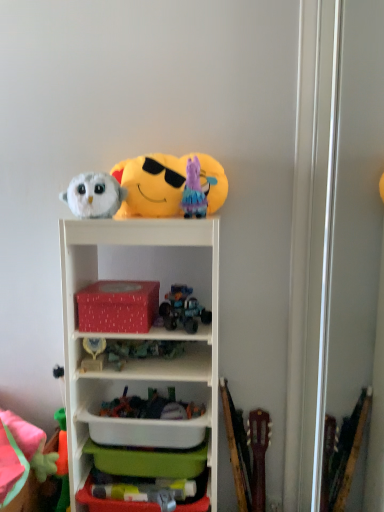
Locate an element on the screen. This screenshot has width=384, height=512. translucent plastic toy at center, positioned as the sixth toy in top-to-bottom order is located at coordinates (141, 350).

I want to click on red matte tissue box at center, the 1th storage box positioned from the top, so click(118, 306).

How much space does green plastic storage box at lower center, the first storage box ordered from the bottom, occupy horizontally?

5.91 inches.

What do you see at coordinates (183, 309) in the screenshot? I see `shiny metallic truck at center, which ranks as the fourth toy in top-to-bottom order` at bounding box center [183, 309].

What is the approximate width of gold metallic trophy at center, acting as the third toy starting from the bottom?

gold metallic trophy at center, acting as the third toy starting from the bottom, is 6.25 centimeters wide.

Locate an element on the screen. Image resolution: width=384 pixels, height=512 pixels. white plastic shelf at center is located at coordinates coord(140,334).

Is red matte tissue box at center, acting as the 2th storage box starting from the bottom, oriented away from shiny metallic truck at center, marked as the 4th toy in a bottom-to-top arrangement?

No, red matte tissue box at center, acting as the 2th storage box starting from the bottom,'s orientation is not away from shiny metallic truck at center, marked as the 4th toy in a bottom-to-top arrangement.

Which point is more forward, (79,311) or (184,321)?

The point (79,311) is more forward.

In order to click on storage box located above the shiny metallic truck at center, marked as the 4th toy in a bottom-to-top arrangement (from a real-world perspective) in this screenshot , I will do `click(118, 306)`.

Considering the sizes of objects red matte tissue box at center, acting as the 2th storage box starting from the bottom, and shiny metallic truck at center, which ranks as the fourth toy in top-to-bottom order, in the image provided, who is shorter, red matte tissue box at center, acting as the 2th storage box starting from the bottom, or shiny metallic truck at center, which ranks as the fourth toy in top-to-bottom order,?

shiny metallic truck at center, which ranks as the fourth toy in top-to-bottom order.

Measure the distance between fluffy white owl at upper left, which is counted as the third toy, starting from the top, and shiny metallic truck at center, which ranks as the fourth toy in top-to-bottom order.

The distance of fluffy white owl at upper left, which is counted as the third toy, starting from the top, from shiny metallic truck at center, which ranks as the fourth toy in top-to-bottom order, is 16.00 inches.

Which is behind, point (62, 196) or point (183, 288)?

Positioned behind is point (183, 288).

Is fluffy white owl at upper left, which is counted as the third toy, starting from the top, next to shiny metallic truck at center, which ranks as the fourth toy in top-to-bottom order?

No, fluffy white owl at upper left, which is counted as the third toy, starting from the top, is not with shiny metallic truck at center, which ranks as the fourth toy in top-to-bottom order.

Is fluffy white owl at upper left, acting as the fifth toy starting from the bottom, thinner than shiny metallic truck at center, marked as the 4th toy in a bottom-to-top arrangement?

No, fluffy white owl at upper left, acting as the fifth toy starting from the bottom, is not thinner than shiny metallic truck at center, marked as the 4th toy in a bottom-to-top arrangement.

Between point (96, 286) and point (86, 490), which one is positioned in front?

The point (86, 490) is closer to the camera.

Which is more to the left, red matte tissue box at center, acting as the 2th storage box starting from the bottom, or green plastic storage box at lower center, the first storage box ordered from the bottom?

red matte tissue box at center, acting as the 2th storage box starting from the bottom, is more to the left.

At what (x,y) coordinates should I click in order to perform the action: click on storage box below the red matte tissue box at center, acting as the 2th storage box starting from the bottom (from the image's perspective). Please return your answer as a coordinate pair (x, y). The image size is (384, 512). Looking at the image, I should click on (110, 502).

Which object is thinner, red matte tissue box at center, acting as the 2th storage box starting from the bottom, or green plastic storage box at lower center, the first storage box ordered from the bottom?

With smaller width is green plastic storage box at lower center, the first storage box ordered from the bottom.

Considering the relative sizes of gold metallic trophy at center, which ranks as the 5th toy in top-to-bottom order, and fluffy pink plush at lower left, marked as the seventh toy in a top-to-bottom arrangement, in the image provided, is gold metallic trophy at center, which ranks as the 5th toy in top-to-bottom order, thinner than fluffy pink plush at lower left, marked as the seventh toy in a top-to-bottom arrangement,?

Indeed, gold metallic trophy at center, which ranks as the 5th toy in top-to-bottom order, has a lesser width compared to fluffy pink plush at lower left, marked as the seventh toy in a top-to-bottom arrangement.

Which point is more forward, (x=101, y=338) or (x=7, y=442)?

The point (x=101, y=338) is closer to the camera.

This screenshot has width=384, height=512. In order to click on the 2nd toy below when counting from the gold metallic trophy at center, acting as the third toy starting from the bottom (from the image's perspective) in this screenshot , I will do `click(21, 456)`.

Is fluffy pink plush at lower left, marked as the seventh toy in a top-to-bottom arrangement, looking in the opposite direction of red matte tissue box at center, the 1th storage box positioned from the top?

fluffy pink plush at lower left, marked as the seventh toy in a top-to-bottom arrangement, does not have its back to red matte tissue box at center, the 1th storage box positioned from the top.

From a real-world perspective, is fluffy pink plush at lower left, marked as the seventh toy in a top-to-bottom arrangement, on red matte tissue box at center, acting as the 2th storage box starting from the bottom?

No, from a real-world perspective, fluffy pink plush at lower left, marked as the seventh toy in a top-to-bottom arrangement, is not above red matte tissue box at center, acting as the 2th storage box starting from the bottom.

Is fluffy pink plush at lower left, marked as the seventh toy in a top-to-bottom arrangement, spatially inside red matte tissue box at center, the 1th storage box positioned from the top, or outside of it?

fluffy pink plush at lower left, marked as the seventh toy in a top-to-bottom arrangement, is not inside red matte tissue box at center, the 1th storage box positioned from the top, it's outside.

Is fluffy pink plush at lower left, marked as the seventh toy in a top-to-bottom arrangement, shorter than red matte tissue box at center, the 1th storage box positioned from the top?

No, fluffy pink plush at lower left, marked as the seventh toy in a top-to-bottom arrangement, is not shorter than red matte tissue box at center, the 1th storage box positioned from the top.

Which object is positioned more to the left, fluffy white owl at upper left, which is counted as the third toy, starting from the top, or white plastic container at center?

fluffy white owl at upper left, which is counted as the third toy, starting from the top, is more to the left.

From the image's perspective, between fluffy white owl at upper left, which is counted as the third toy, starting from the top, and white plastic container at center, which one is located above?

From the image's view, fluffy white owl at upper left, which is counted as the third toy, starting from the top, is above.

Who is taller, fluffy white owl at upper left, acting as the fifth toy starting from the bottom, or white plastic container at center?

Standing taller between the two is fluffy white owl at upper left, acting as the fifth toy starting from the bottom.

Does point (66, 201) appear closer or farther from the camera than point (106, 432)?

Point (66, 201) is positioned closer to the camera compared to point (106, 432).

Is point (85, 411) farther from camera compared to point (38, 466)?

Yes, point (85, 411) is behind point (38, 466).

From the image's perspective, is white plastic shelf at center located above fluffy pink plush at lower left, marked as the seventh toy in a top-to-bottom arrangement?

Yes, from the image's perspective, white plastic shelf at center is over fluffy pink plush at lower left, marked as the seventh toy in a top-to-bottom arrangement.

Are white plastic shelf at center and fluffy pink plush at lower left, marked as the seventh toy in a top-to-bottom arrangement, making contact?

white plastic shelf at center and fluffy pink plush at lower left, marked as the seventh toy in a top-to-bottom arrangement, are not in contact.

Based on their positions, is white plastic shelf at center located to the left or right of fluffy pink plush at lower left, positioned as the first toy in bottom-to-top order?

From the image, it's evident that white plastic shelf at center is to the right of fluffy pink plush at lower left, positioned as the first toy in bottom-to-top order.

Locate an element on the screen. Image resolution: width=384 pixels, height=512 pixels. storage box that is behind the shiny metallic truck at center, marked as the 4th toy in a bottom-to-top arrangement is located at coordinates (118, 306).

Where is `the 1st toy positioned above the shiny metallic truck at center, marked as the 4th toy in a bottom-to-top arrangement (from the image's perspective)`? the 1st toy positioned above the shiny metallic truck at center, marked as the 4th toy in a bottom-to-top arrangement (from the image's perspective) is located at coordinates (94, 195).

From the picture: Estimate the real-world distances between objects in this image. Which object is further from red matte tissue box at center, acting as the 2th storage box starting from the bottom, soft plush emoji at upper center, which appears as the 1th toy when viewed from the top, or fluffy pink plush at lower left, positioned as the first toy in bottom-to-top order?

fluffy pink plush at lower left, positioned as the first toy in bottom-to-top order.

Which object lies further to the anchor point translucent plastic toy at center, arranged as the 2th toy when ordered from the bottom, red matte tissue box at center, acting as the 2th storage box starting from the bottom, or white plastic shelf at center?

The object further to translucent plastic toy at center, arranged as the 2th toy when ordered from the bottom, is white plastic shelf at center.

Based on the photo, based on their spatial positions, is shiny metallic truck at center, which ranks as the fourth toy in top-to-bottom order, or plush purple at upper center, the 6th toy in the bottom-to-top sequence, closer to gold metallic trophy at center, acting as the third toy starting from the bottom?

Among the two, shiny metallic truck at center, which ranks as the fourth toy in top-to-bottom order, is located nearer to gold metallic trophy at center, acting as the third toy starting from the bottom.

Estimate the real-world distances between objects in this image. Which object is further from white plastic container at center, fluffy pink plush at lower left, marked as the seventh toy in a top-to-bottom arrangement, or fluffy white owl at upper left, acting as the fifth toy starting from the bottom?

Among the two, fluffy white owl at upper left, acting as the fifth toy starting from the bottom, is located further to white plastic container at center.

Estimate the real-world distances between objects in this image. Which object is further from fluffy pink plush at lower left, marked as the seventh toy in a top-to-bottom arrangement, soft plush emoji at upper center, the 7th toy when ordered from bottom to top, or white plastic shelf at center?

soft plush emoji at upper center, the 7th toy when ordered from bottom to top, lies further to fluffy pink plush at lower left, marked as the seventh toy in a top-to-bottom arrangement, than the other object.

Estimate the real-world distances between objects in this image. Which object is closer to translucent plastic toy at center, positioned as the sixth toy in top-to-bottom order, plush purple at upper center, placed as the second toy when sorted from top to bottom, or fluffy pink plush at lower left, positioned as the first toy in bottom-to-top order?

fluffy pink plush at lower left, positioned as the first toy in bottom-to-top order, is closer to translucent plastic toy at center, positioned as the sixth toy in top-to-bottom order.

From the image, which object appears to be farther from fluffy white owl at upper left, acting as the fifth toy starting from the bottom, white plastic shelf at center or white plastic container at center?

The object further to fluffy white owl at upper left, acting as the fifth toy starting from the bottom, is white plastic container at center.

Estimate the real-world distances between objects in this image. Which object is further from soft plush emoji at upper center, the 7th toy when ordered from bottom to top, translucent plastic toy at center, positioned as the sixth toy in top-to-bottom order, or green plastic storage box at lower center, the first storage box ordered from the bottom?

green plastic storage box at lower center, the first storage box ordered from the bottom.

Where is `storage box between plush purple at upper center, placed as the second toy when sorted from top to bottom, and white plastic container at center vertically`? The width and height of the screenshot is (384, 512). storage box between plush purple at upper center, placed as the second toy when sorted from top to bottom, and white plastic container at center vertically is located at coordinates (118, 306).

This screenshot has height=512, width=384. I want to click on shelf between red matte tissue box at center, acting as the 2th storage box starting from the bottom, and fluffy pink plush at lower left, positioned as the first toy in bottom-to-top order, vertically, so click(x=140, y=334).

This screenshot has width=384, height=512. Identify the location of shelf between gold metallic trophy at center, acting as the third toy starting from the bottom, and shiny metallic truck at center, marked as the 4th toy in a bottom-to-top arrangement. (140, 334).

At what (x,y) coordinates should I click in order to perform the action: click on storage box between fluffy white owl at upper left, which is counted as the third toy, starting from the top, and white plastic shelf at center from top to bottom. Please return your answer as a coordinate pair (x, y). This screenshot has width=384, height=512. Looking at the image, I should click on click(x=118, y=306).